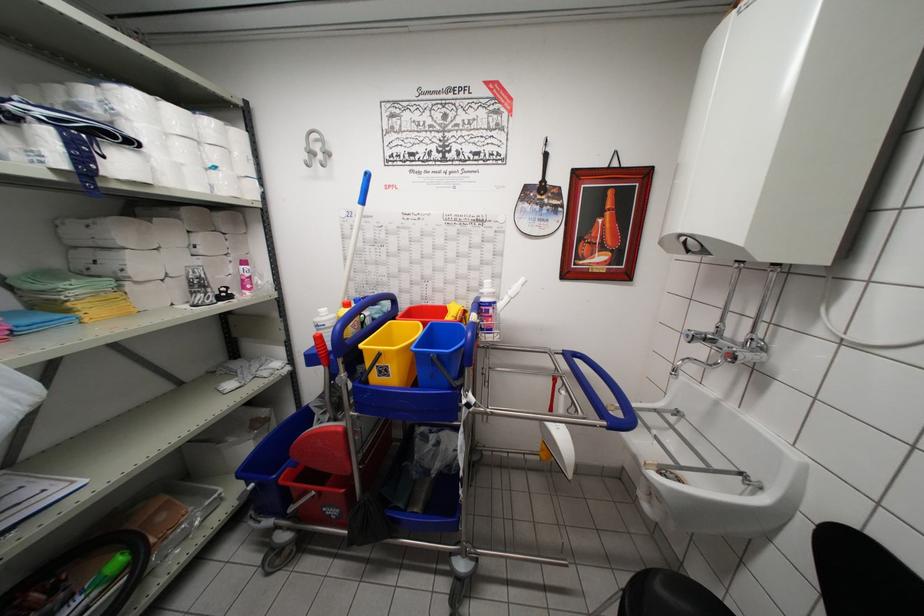
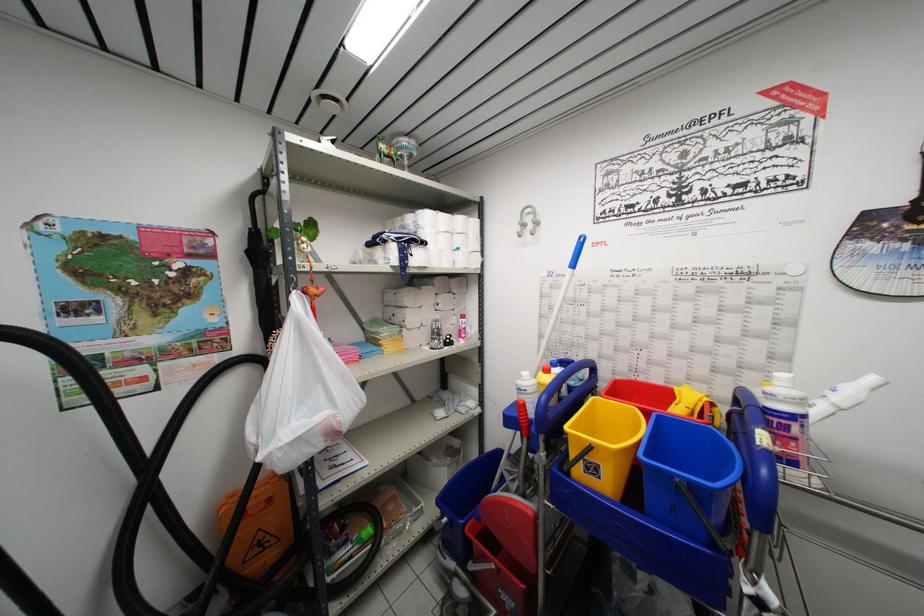
Where in the second image is the point corresponding to the point at 489,314 from the first image?

(783, 428)